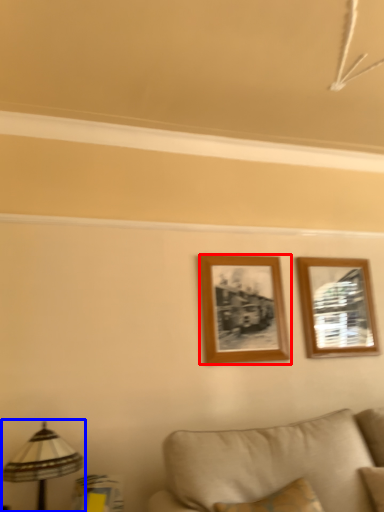
Question: Which of the following is the farthest to the observer, picture frame (highlighted by a red box) or table lamp (highlighted by a blue box)?

Choices:
 (A) picture frame
 (B) table lamp

Answer: (A)